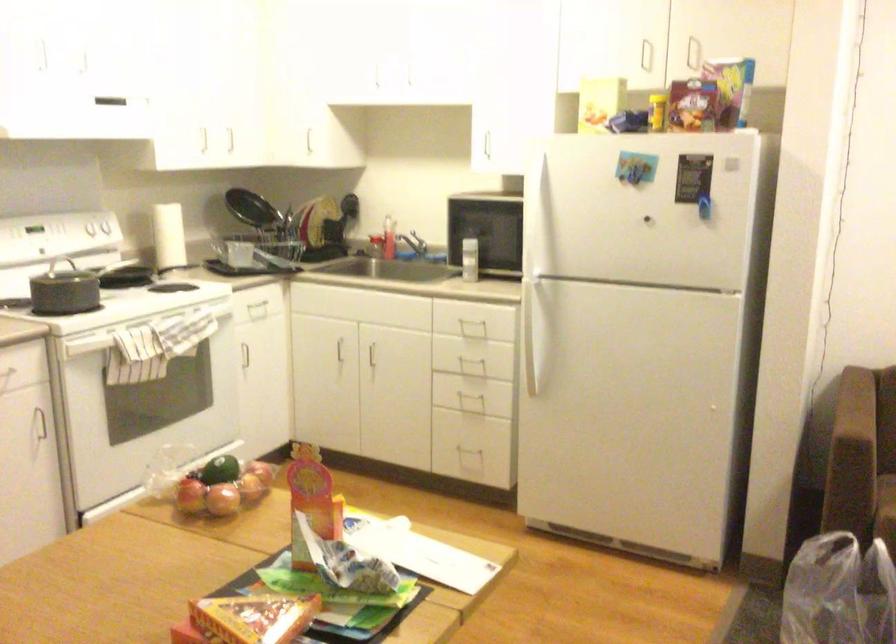
Find the location of `sink faucet handle`. sink faucet handle is located at coordinates (403, 247).